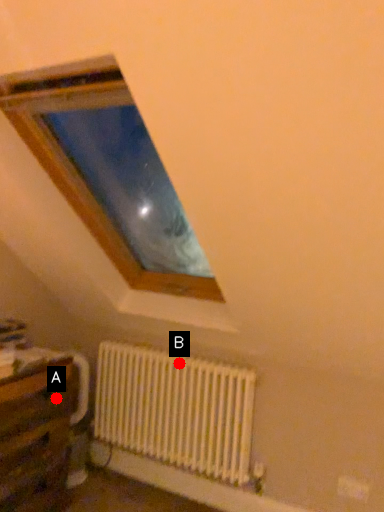
Question: Two points are circled on the image, labeled by A and B beside each circle. Which point is further to the camera?

Choices:
 (A) A is further
 (B) B is further

Answer: (B)